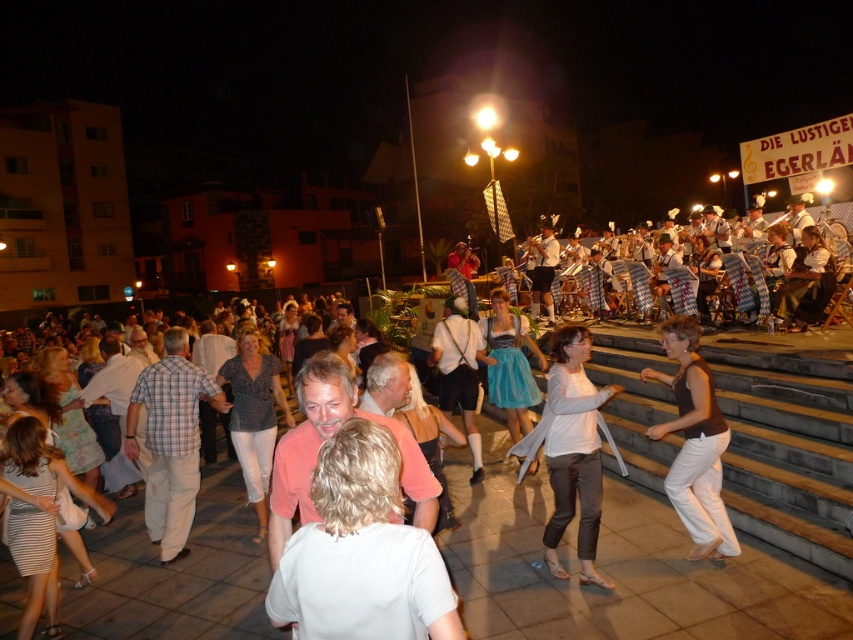
From the picture: Can you confirm if white matte pants at center is thinner than blue satin dirndl at center?

Correct, white matte pants at center's width is less than blue satin dirndl at center's.

Who is more forward, [596,490] or [497,376]?

Point [596,490]

Where is `white matte pants at center`? This screenshot has width=853, height=640. white matte pants at center is located at coordinates (573, 451).

Is white matte pants at center above brown smooth tank top at center?

Actually, white matte pants at center is below brown smooth tank top at center.

I want to click on white matte pants at center, so (573, 451).

Can you confirm if patterned fabric blouse at center is shorter than blue satin dirndl at center?

In fact, patterned fabric blouse at center may be taller than blue satin dirndl at center.

Does patterned fabric blouse at center appear over blue satin dirndl at center?

No.

Is point (253, 419) positioned before point (527, 380)?

Yes, it is in front of point (527, 380).

Locate an element on the screen. The image size is (853, 640). patterned fabric blouse at center is located at coordinates (254, 417).